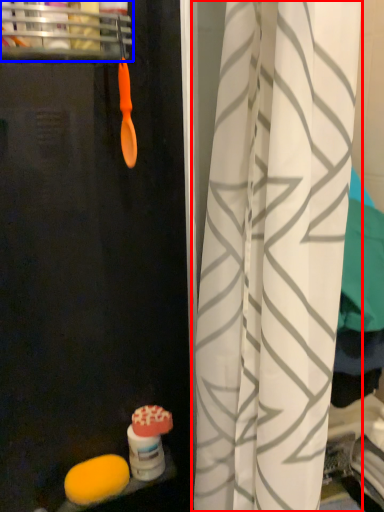
Question: Which object is closer to the camera taking this photo, curtain (highlighted by a red box) or shelf (highlighted by a blue box)?

Choices:
 (A) curtain
 (B) shelf

Answer: (A)